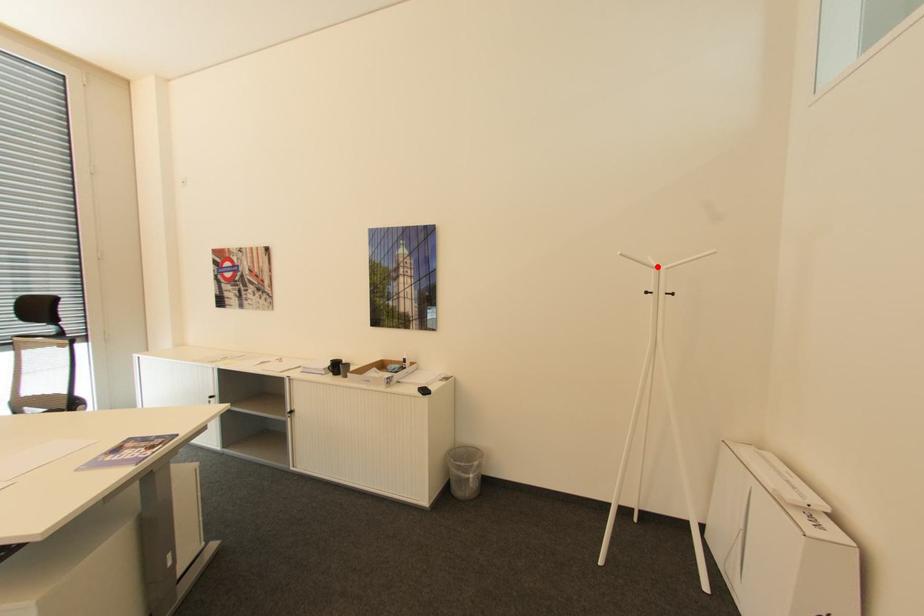
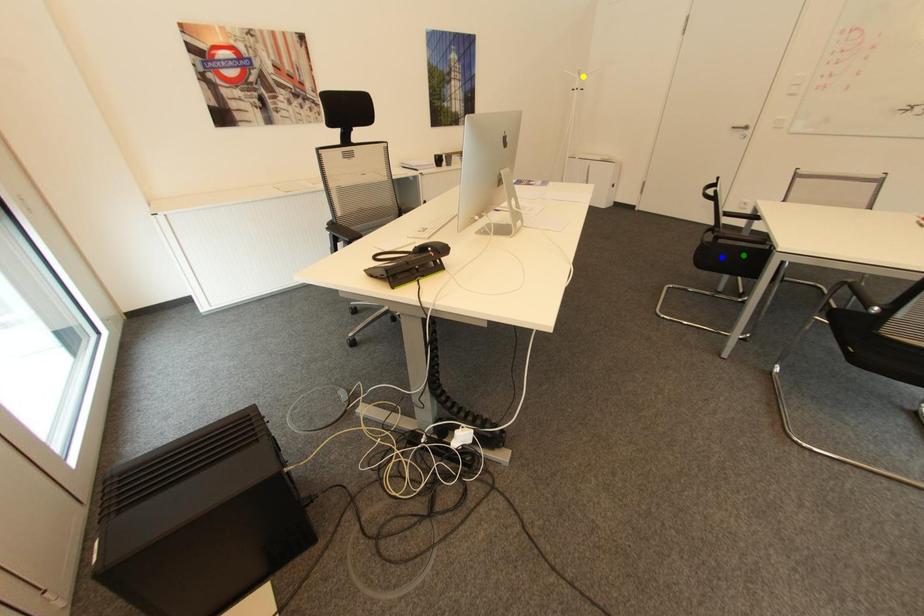
Question: I am providing you with two images of the same scene from different viewpoints. A red point is marked on the first image. You are given multiple points on the second image. Which point in image 2 represents the same 3d spot as the red point in image 1?

Choices:
 (A) green point
 (B) blue point
 (C) yellow point

Answer: (C)